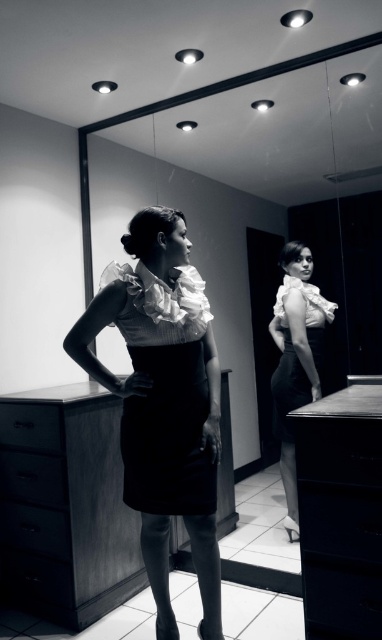
You are a fashion designer who needs to store the black satin dress at center and the matte wood drawer at lower left. Which object requires more space for storage?

The black satin dress at center requires more space for storage because it is bigger than the matte wood drawer at lower left.

You are a photographer adjusting your camera to focus on two points in the image. The first point is at coordinate point (372, 560) and the second is at point (48, 541). Which point should you focus on first if you want to capture the closest object to the camera?

Point (372, 560) is closer to the viewer than point (48, 541), so you should focus on point (372, 560) first to capture the closest object to the camera.

You are a photographer setting up for a photoshoot in this dressing room. You need to position a light source exactly 2 meters away from where the camera will be placed. The only available spot to place the light is at point (212, 490). Will this point be the correct distance for the light source?

Yes, the point (212, 490) is exactly 2.00 meters from the camera, so placing the light there will meet the requirement.